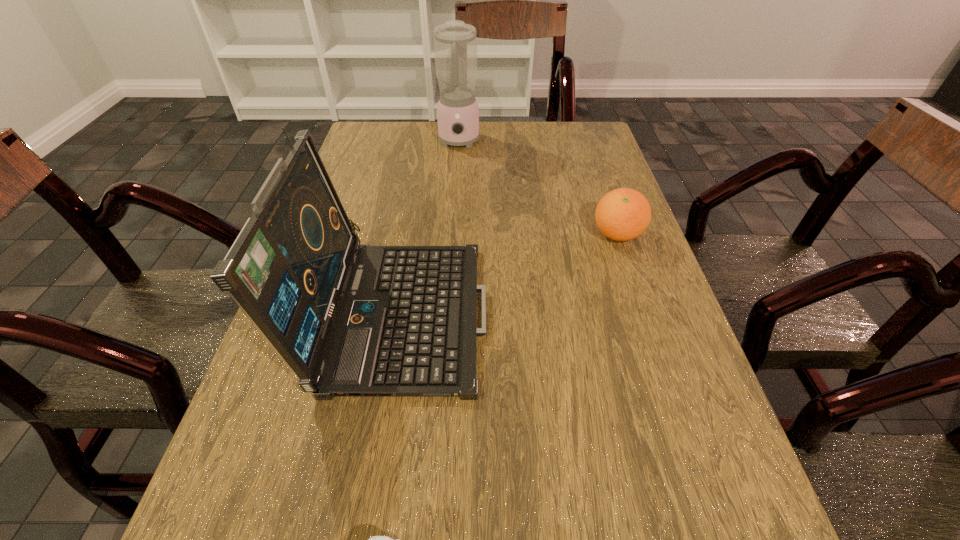
You are a GUI agent. You are given a task and a screenshot of the screen. Output one action in this format:
    pyautogui.click(x=<x>, y=<y>)
    Task: Click on the food processor
    
    Given the screenshot: What is the action you would take?
    pyautogui.click(x=455, y=43)

Where is `laptop computer`? laptop computer is located at coordinates (389, 321).

This screenshot has width=960, height=540. Find the location of `the second shortest object`. the second shortest object is located at coordinates 623,214.

The width and height of the screenshot is (960, 540). In order to click on orange in this screenshot , I will do `click(623, 214)`.

I want to click on free space located 0.380m on the base of the farthest object near the control knob, so click(x=452, y=242).

The image size is (960, 540). In order to click on free space located 0.130m on the front-facing side of the laptop computer in this screenshot , I will do `click(553, 307)`.

Where is `free region located 0.260m on the back of the third tallest object`? This screenshot has height=540, width=960. free region located 0.260m on the back of the third tallest object is located at coordinates (592, 162).

This screenshot has height=540, width=960. Find the location of `object at the far edge`. object at the far edge is located at coordinates (455, 43).

Identify the location of object that is at the left edge. Image resolution: width=960 pixels, height=540 pixels. (389, 321).

Find the location of a particular element. Image resolution: width=960 pixels, height=540 pixels. object that is at the right edge is located at coordinates (623, 214).